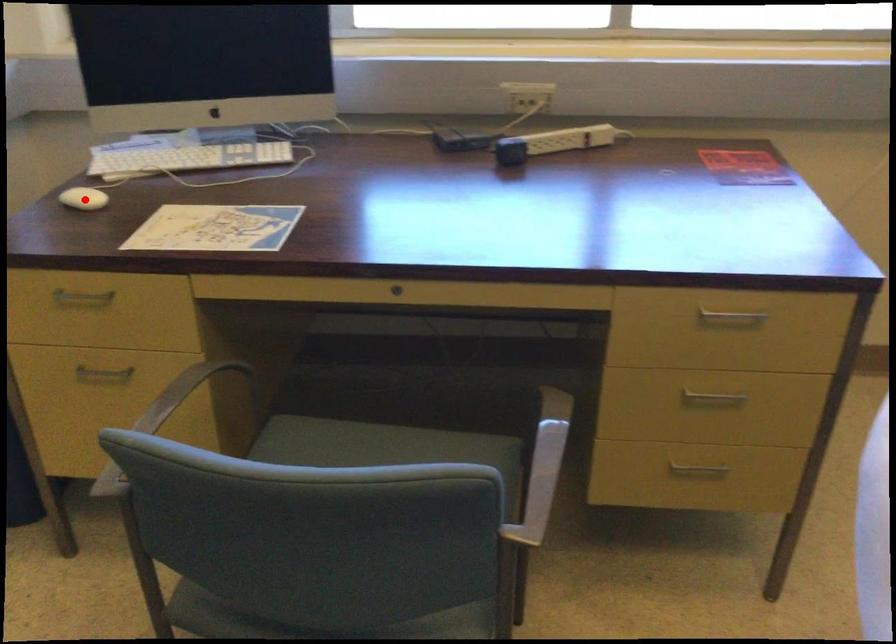
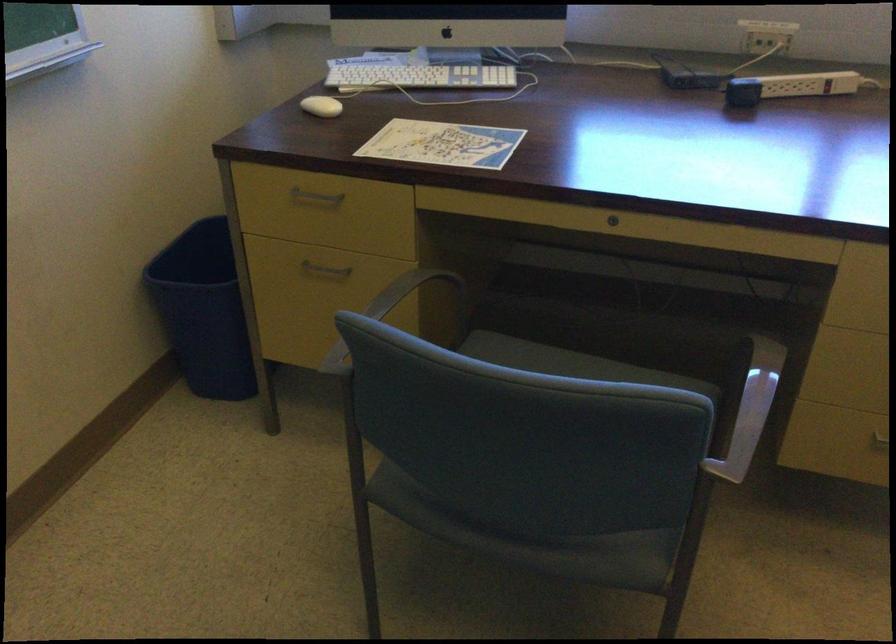
Locate, in the second image, the point that corresponds to the highlighted location in the first image.

(321, 106)